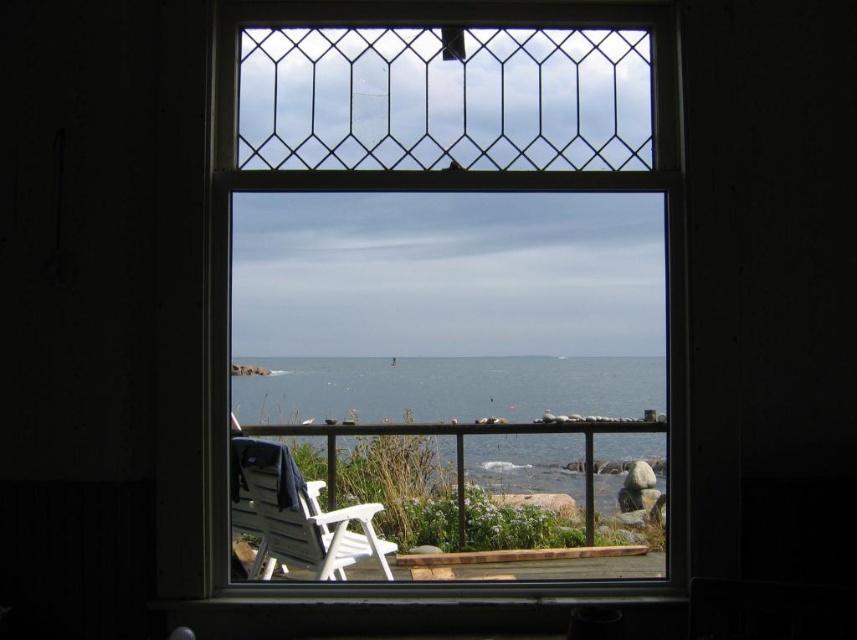
Does blue water at center come in front of white plastic rocking chair at lower center?

Yes, it is in front of white plastic rocking chair at lower center.

Measure the distance between blue water at center and camera.

They are 2.77 meters apart.

The width and height of the screenshot is (857, 640). Identify the location of blue water at center. (478, 410).

Can you confirm if clear glass window at center is bigger than blue water at center?

Correct, clear glass window at center is larger in size than blue water at center.

Is clear glass window at center behind blue water at center?

No, clear glass window at center is closer to the viewer.

Does point (232, 52) come behind point (423, 401)?

That is False.

Locate an element on the screen. Image resolution: width=857 pixels, height=640 pixels. clear glass window at center is located at coordinates (446, 284).

Can you confirm if clear glass window at center is positioned to the left of white plastic rocking chair at lower center?

In fact, clear glass window at center is to the right of white plastic rocking chair at lower center.

Describe the element at coordinates (446, 284) in the screenshot. I see `clear glass window at center` at that location.

Locate an element on the screen. This screenshot has height=640, width=857. clear glass window at center is located at coordinates (446, 284).

You are a GUI agent. You are given a task and a screenshot of the screen. Output one action in this format:
    pyautogui.click(x=<x>, y=<y>)
    Task: Click on the clear glass window at center
    This screenshot has width=857, height=640.
    Given the screenshot: What is the action you would take?
    pyautogui.click(x=446, y=284)